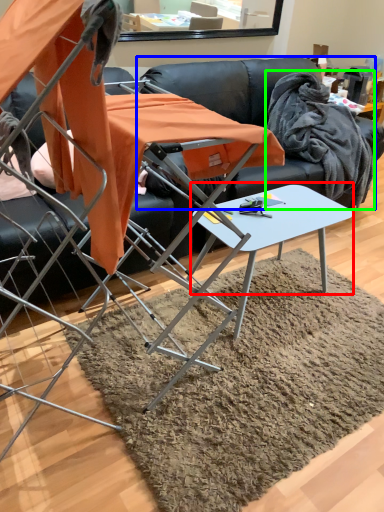
Question: Considering the real-world distances, which object is closest to round table (highlighted by a red box)? couch (highlighted by a blue box) or fabric (highlighted by a green box).

Choices:
 (A) couch
 (B) fabric

Answer: (A)